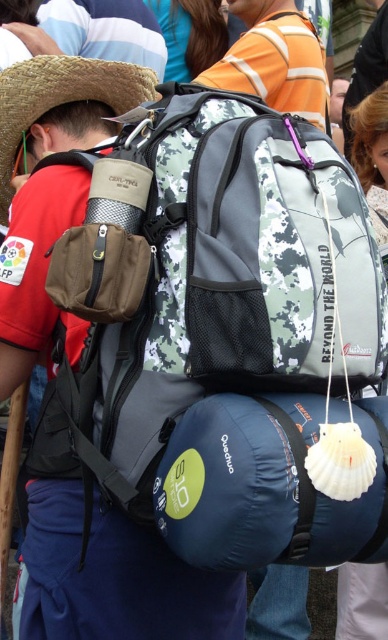
Does straw hat at upper left appear under dark brown leather jacket at upper center?

Yes.

Between straw hat at upper left and dark brown leather jacket at upper center, which one has less height?

With less height is dark brown leather jacket at upper center.

Is point (72, 68) behind point (381, 77)?

That is False.

Find the location of a particular element. Image resolution: width=388 pixels, height=640 pixels. straw hat at upper left is located at coordinates (60, 97).

Who is shorter, camouflage backpack at center or straw hat at upper left?

straw hat at upper left is shorter.

Is camouflage backpack at center wider than straw hat at upper left?

Yes.

This screenshot has height=640, width=388. What do you see at coordinates (275, 60) in the screenshot?
I see `camouflage backpack at center` at bounding box center [275, 60].

Identify the location of camouflage backpack at center. The width and height of the screenshot is (388, 640). (275, 60).

Is blue synthetic sleeping bag at lower center wider than dark brown leather jacket at upper center?

Indeed, blue synthetic sleeping bag at lower center has a greater width compared to dark brown leather jacket at upper center.

The image size is (388, 640). Describe the element at coordinates (266, 486) in the screenshot. I see `blue synthetic sleeping bag at lower center` at that location.

This screenshot has width=388, height=640. Identify the location of blue synthetic sleeping bag at lower center. (266, 486).